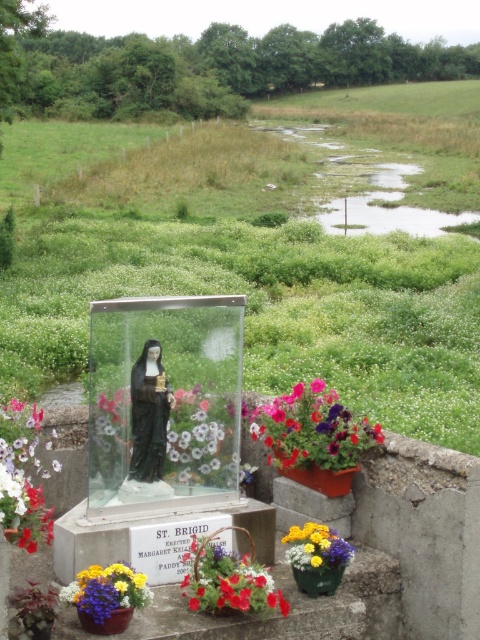
You are standing in front of the St. Brigid shrine and want to place a new flower pot between the two points marked as point (249, 586) and point (324, 531). Which point should you start placing the flower pot closer to in order to ensure it is nearer to the shrine?

You should start placing the flower pot closer to point (249, 586) because it is closer to the viewer than point (324, 531), meaning it is nearer to the shrine.

You are standing at the shrine and want to place a new flower pot between the two points, point (197, 458) and point (213, 592). Which point should the flower pot be closer to if it needs to be in front of the shrine?

The flower pot should be closer to point (213, 592) because point (197, 458) is behind point (213, 592), so placing it near the front point ensures it is in front of the shrine.